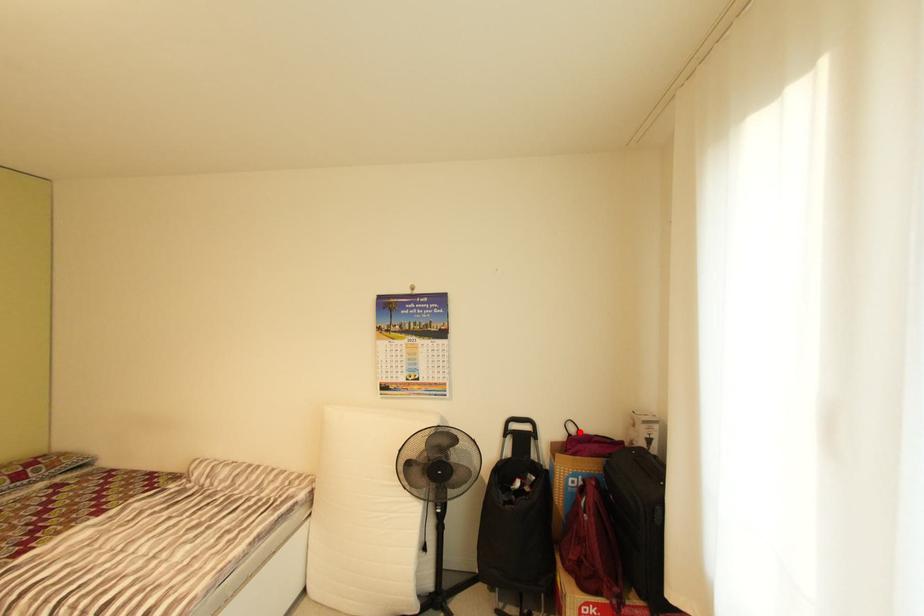
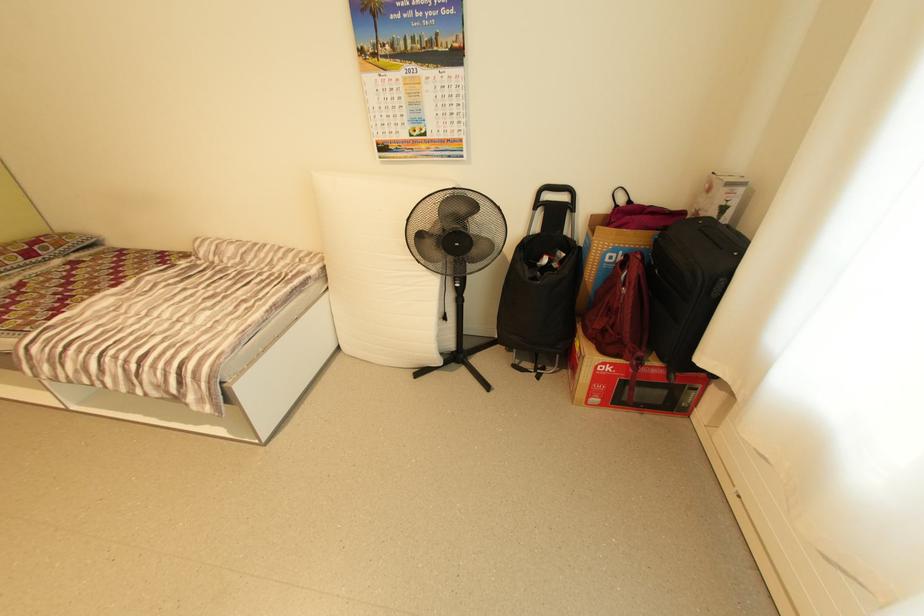
The point at the highlighted location is marked in the first image. Where is the corresponding point in the second image?

(628, 201)